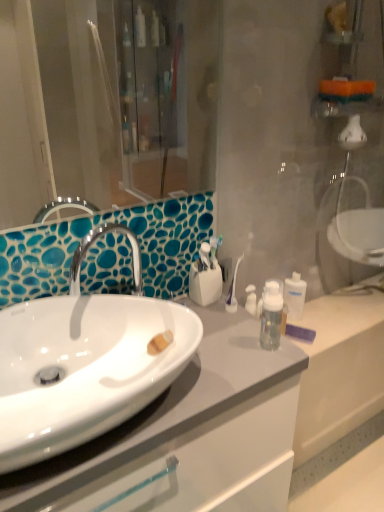
Question: Is the depth of white glossy sink at center less than that of clear plastic bottle at center-right?

Choices:
 (A) no
 (B) yes

Answer: (B)

Question: Does white glossy sink at center have a lesser width compared to clear plastic bottle at center-right?

Choices:
 (A) no
 (B) yes

Answer: (A)

Question: Can you confirm if white glossy sink at center is smaller than clear plastic bottle at center-right?

Choices:
 (A) yes
 (B) no

Answer: (B)

Question: Can we say white glossy sink at center lies outside clear plastic bottle at center-right?

Choices:
 (A) no
 (B) yes

Answer: (B)

Question: Does white glossy sink at center come behind clear plastic bottle at center-right?

Choices:
 (A) no
 (B) yes

Answer: (A)

Question: Would you say white glossy sink at center contains clear plastic bottle at center-right?

Choices:
 (A) yes
 (B) no

Answer: (B)

Question: From a real-world perspective, is clear plastic bottle at center-right below white glossy sink at center?

Choices:
 (A) no
 (B) yes

Answer: (B)

Question: Is white glossy sink at center surrounded by clear plastic bottle at center-right?

Choices:
 (A) no
 (B) yes

Answer: (A)

Question: Does clear plastic bottle at center-right appear on the right side of white glossy sink at center?

Choices:
 (A) no
 (B) yes

Answer: (B)

Question: From the image's perspective, does clear plastic bottle at center-right appear lower than white glossy sink at center?

Choices:
 (A) no
 (B) yes

Answer: (A)

Question: From a real-world perspective, is clear plastic bottle at center-right on white glossy sink at center?

Choices:
 (A) no
 (B) yes

Answer: (A)

Question: Does clear plastic bottle at center-right have a larger size compared to white glossy sink at center?

Choices:
 (A) no
 (B) yes

Answer: (A)

Question: Does white glossy sink at center have a larger size compared to white glossy cabinet at center?

Choices:
 (A) yes
 (B) no

Answer: (B)